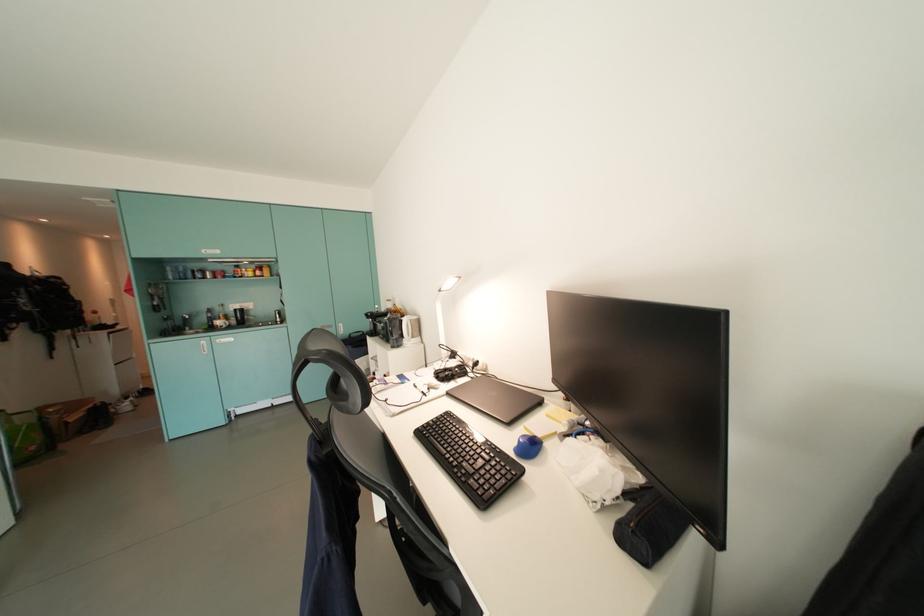
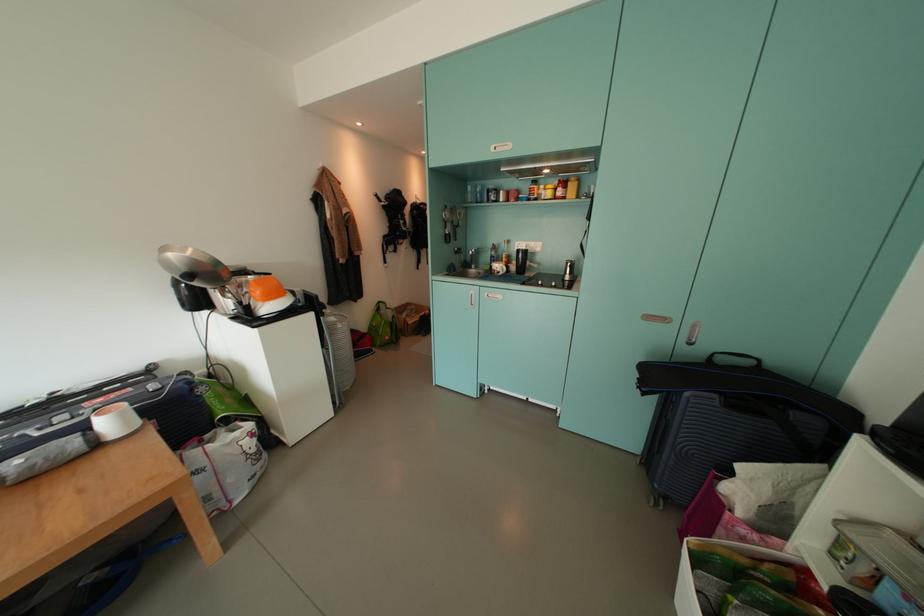
In the second image, find the point that corresponds to (x=360, y=339) in the first image.

(730, 363)